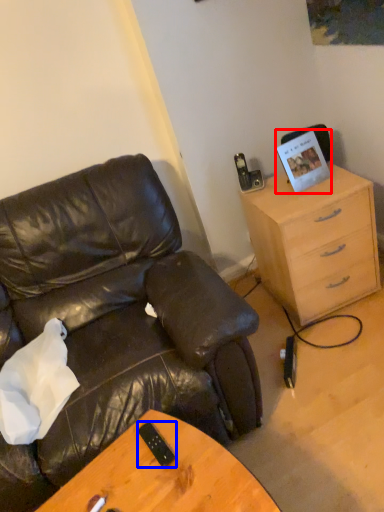
Question: Which of the following is the closest to the observer, picture frame (highlighted by a red box) or mobile phone (highlighted by a blue box)?

Choices:
 (A) picture frame
 (B) mobile phone

Answer: (B)